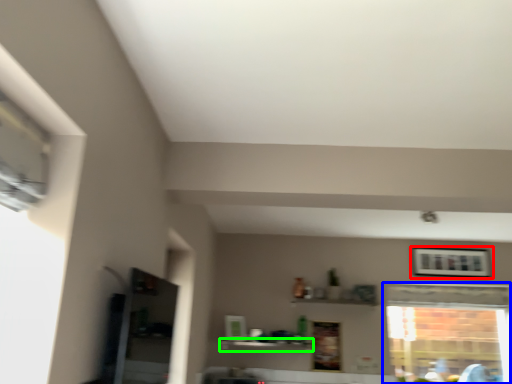
Question: Which object is the closest to the picture frame (highlighted by a red box)? Choose among these: window (highlighted by a blue box) or shelf (highlighted by a green box).

Choices:
 (A) window
 (B) shelf

Answer: (A)